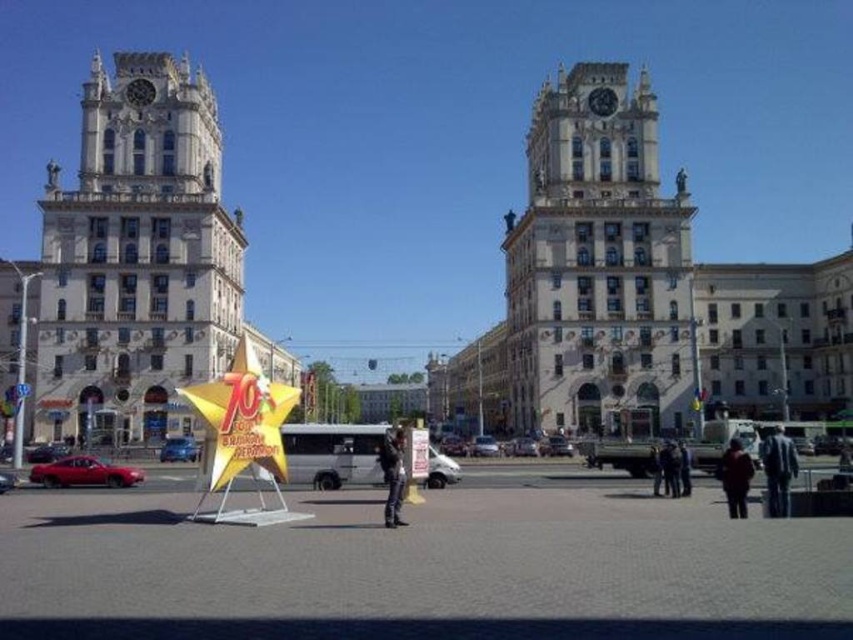
Between point (44, 433) and point (737, 484), which one is positioned in front?

Point (737, 484) is more forward.

Is point (106, 260) positioned behind point (740, 452)?

Yes, it is.

You are a GUI agent. You are given a task and a screenshot of the screen. Output one action in this format:
    pyautogui.click(x=<x>, y=<y>)
    Task: Click on the white stone clock tower at left
    The height and width of the screenshot is (640, 853).
    Given the screenshot: What is the action you would take?
    pyautogui.click(x=136, y=259)

Between point (593, 118) and point (734, 472), which one is positioned behind?

The point (593, 118) is more distant.

Who is positioned more to the right, white stone clock tower at center or dark brown leather jacket at lower right?

dark brown leather jacket at lower right

Identify the location of white stone clock tower at center. (598, 266).

In order to click on white stone clock tower at center in this screenshot , I will do `click(598, 266)`.

Does point (663, 220) come closer to viewer compared to point (782, 515)?

No.

Locate an element on the screen. white stone clock tower at center is located at coordinates (598, 266).

What do you see at coordinates (598, 266) in the screenshot? I see `white stone clock tower at center` at bounding box center [598, 266].

I want to click on white stone clock tower at center, so click(x=598, y=266).